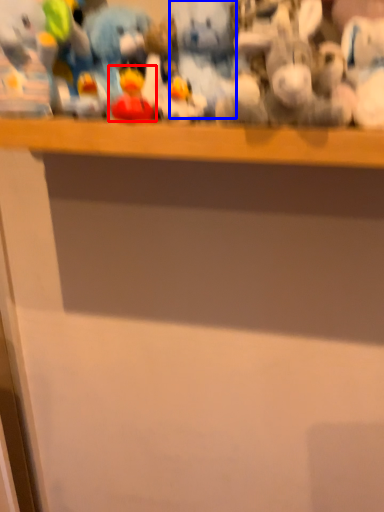
Question: Among these objects, which one is farthest to the camera, toy (highlighted by a red box) or toy (highlighted by a blue box)?

Choices:
 (A) toy
 (B) toy

Answer: (B)